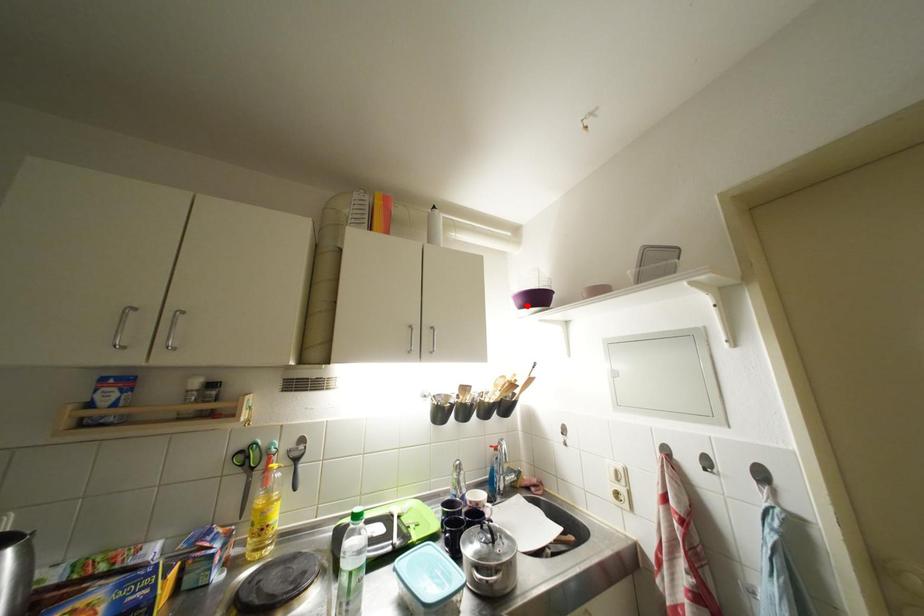
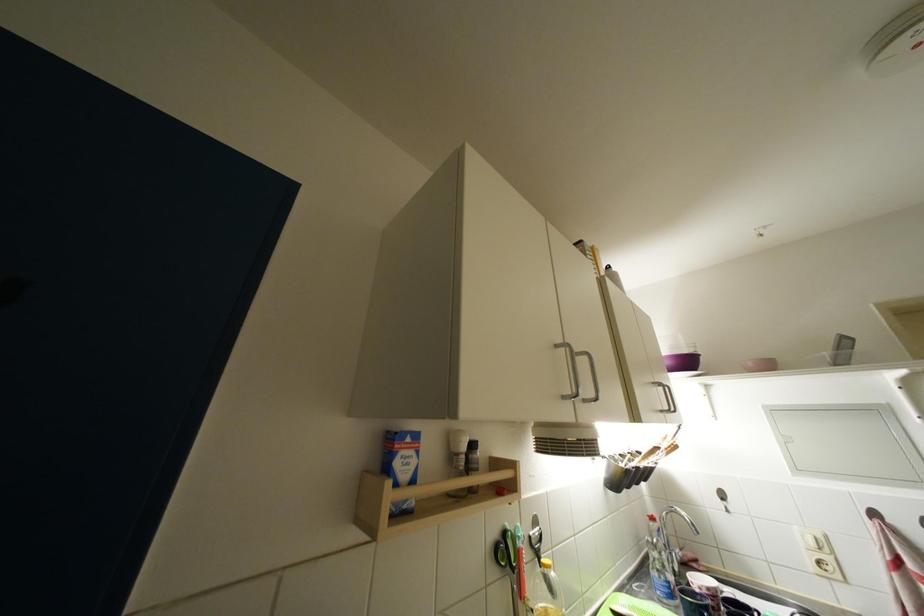
Locate, in the second image, the point that corresponds to the highlighted location in the first image.

(675, 367)